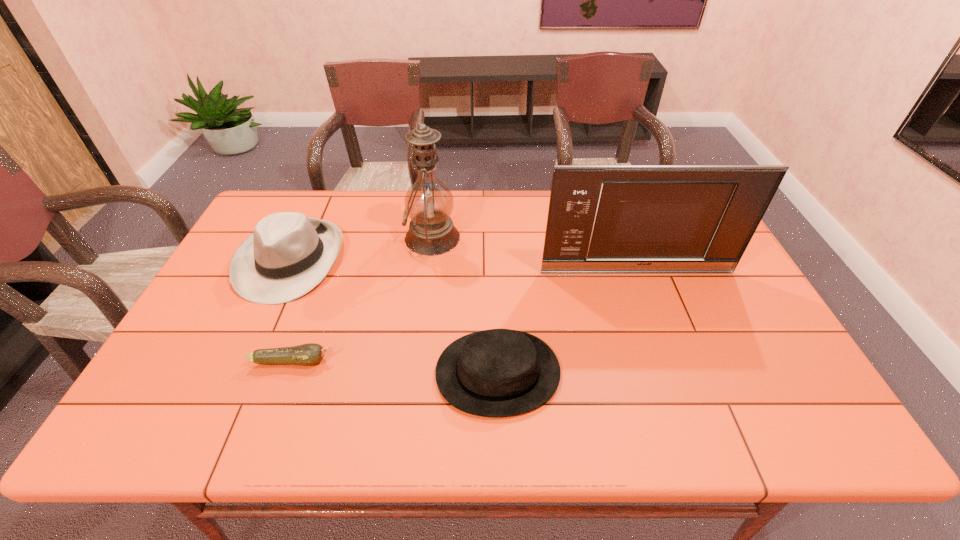
At what (x,y) coordinates should I click in order to perform the action: click on vacant space situated 0.190m on the back of the shorter fedora. Please return your answer as a coordinate pair (x, y). This screenshot has height=540, width=960. Looking at the image, I should click on (494, 280).

Identify the location of free space located at the blossom end of the zucchini. The height and width of the screenshot is (540, 960). (420, 361).

In order to click on oil lamp that is at the far edge in this screenshot , I will do `click(429, 203)`.

Find the location of `fedora that is positioned at the far edge`. fedora that is positioned at the far edge is located at coordinates (289, 254).

In order to click on object that is at the near edge in this screenshot , I will do `click(499, 372)`.

Locate an element on the screen. This screenshot has height=540, width=960. object that is at the left edge is located at coordinates (289, 254).

Identify the location of object located in the right edge section of the desktop. (628, 219).

I want to click on object that is at the far left corner, so click(x=289, y=254).

This screenshot has width=960, height=540. In order to click on free point at the far edge in this screenshot , I will do `click(396, 206)`.

Find the location of a particular element. This screenshot has height=540, width=960. free space at the left edge of the desktop is located at coordinates (161, 372).